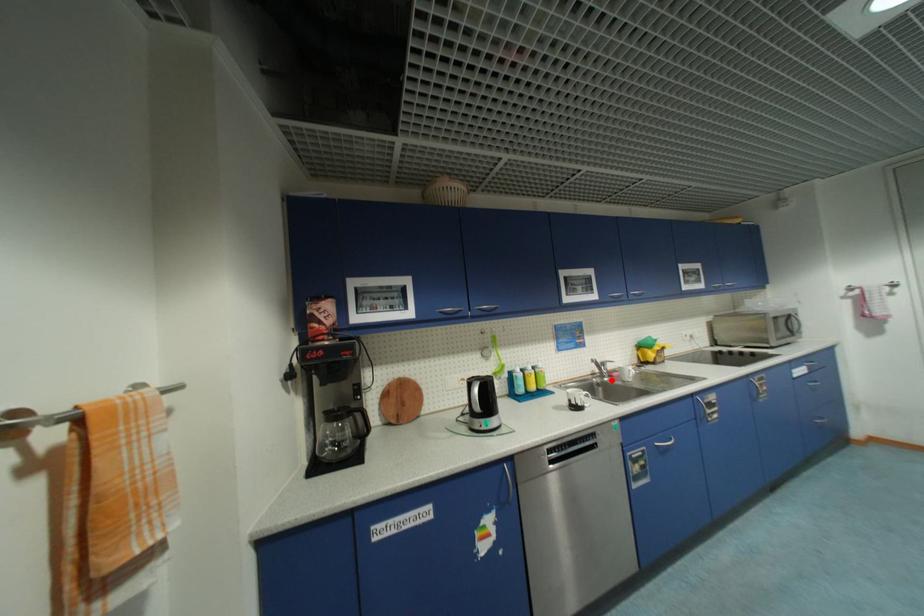
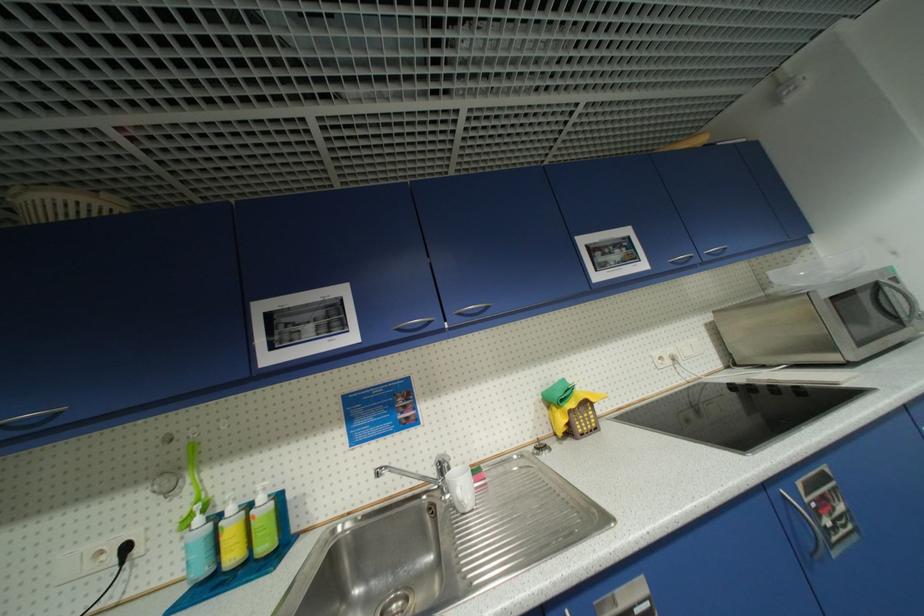
In the second image, find the point that corresponds to the highlighted location in the first image.

(454, 496)